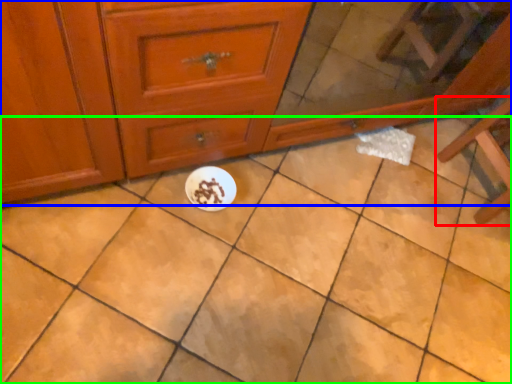
Question: Which object is positioned farthest from furniture (highlighted by a red box)? Select from chest of drawers (highlighted by a blue box) and ceramic tile (highlighted by a green box).

Choices:
 (A) chest of drawers
 (B) ceramic tile

Answer: (A)